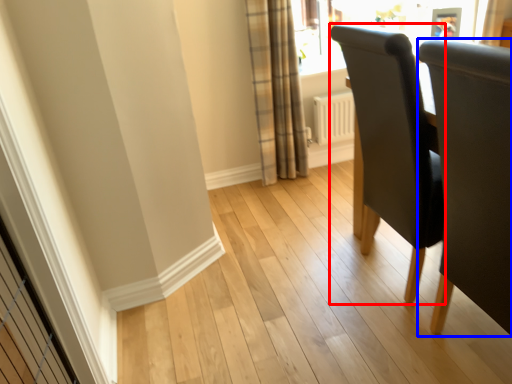
Question: Which point is closer to the camera, chair (highlighted by a red box) or chair (highlighted by a blue box)?

Choices:
 (A) chair
 (B) chair

Answer: (B)